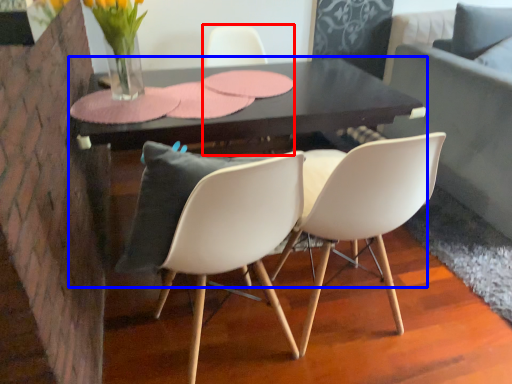
Question: Which object is further to the camera taking this photo, chair (highlighted by a red box) or table (highlighted by a blue box)?

Choices:
 (A) chair
 (B) table

Answer: (A)